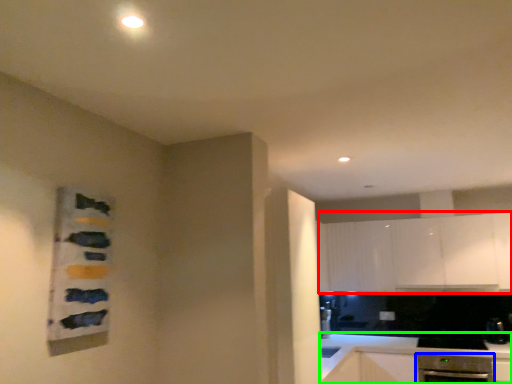
Question: Which object is positioned farthest from cabinetry (highlighted by a red box)? Select from dish washer (highlighted by a blue box) and countertop (highlighted by a green box).

Choices:
 (A) dish washer
 (B) countertop

Answer: (A)